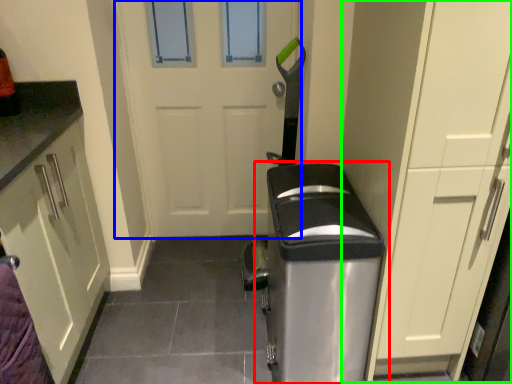
Question: Which is nearer to the home appliance (highlighted by a red box)? door (highlighted by a blue box) or dresser (highlighted by a green box).

Choices:
 (A) door
 (B) dresser

Answer: (B)